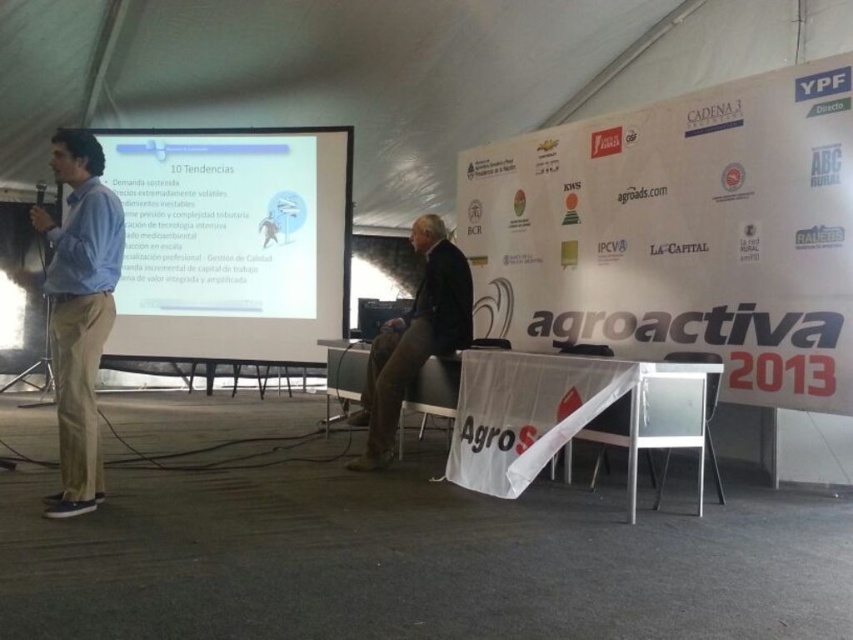
Between white paper banner at upper center and white matte projection screen at center, which one appears on the right side from the viewer's perspective?

white paper banner at upper center is more to the right.

Locate an element on the screen. The height and width of the screenshot is (640, 853). white paper banner at upper center is located at coordinates (682, 234).

From the picture: Who is more forward, (692,124) or (210,212)?

Point (692,124) is in front.

At what (x,y) coordinates should I click in order to perform the action: click on white paper banner at upper center. Please return your answer as a coordinate pair (x, y). Looking at the image, I should click on (682, 234).

Does white paper banner at upper center have a lesser height compared to light blue shirt at left?

In fact, white paper banner at upper center may be taller than light blue shirt at left.

Is the position of white paper banner at upper center less distant than that of light blue shirt at left?

No, it is behind light blue shirt at left.

Is point (585, 220) more distant than point (117, 260)?

Yes, point (585, 220) is behind point (117, 260).

What are the coordinates of `white paper banner at upper center` in the screenshot? It's located at (682, 234).

Does point (73, 396) come in front of point (430, 337)?

Yes, it is.

Which is more to the left, light blue shirt at left or dark brown leather jacket at center?

Positioned to the left is light blue shirt at left.

Describe the element at coordinates (79, 308) in the screenshot. I see `light blue shirt at left` at that location.

Identify the location of light blue shirt at left. The height and width of the screenshot is (640, 853). pyautogui.click(x=79, y=308).